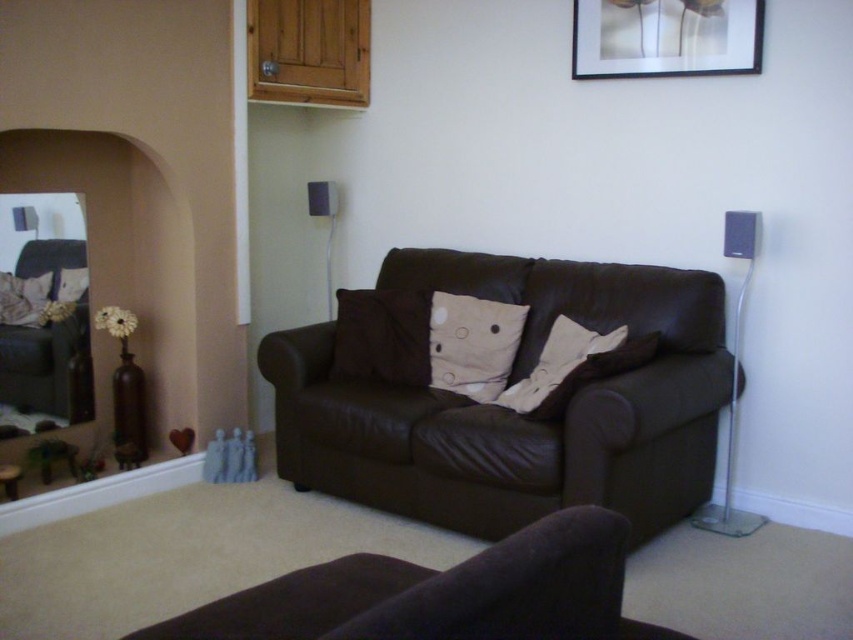
You are standing in the living room and want to place a new side table next to the brown leather couch at center. According to the coordinates provided, where should you place the side table in relation to the couch?

The brown leather couch at center is located at coordinates point (511, 410). To place the side table next to it, position it adjacent to these coordinates, ensuring it aligns with the couch.

You are standing in the living room and want to place a small table between the two points, point (701, 68) and point (428, 360). Which point should the table be closer to if you want it to be near the fireplace?

The table should be placed closer to point (701, 68) because it is closer to the viewer, which is near the fireplace.